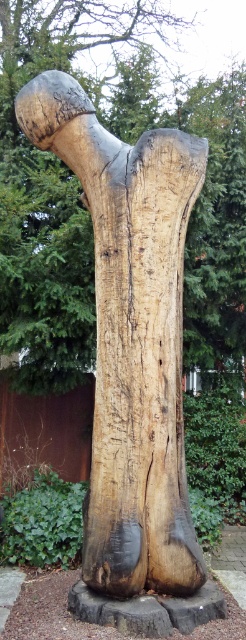
You are an artist planning to photograph the natural wood sculpture at center and the natural wood tree trunk at center. To ensure both are visible in the frame, which object should you position closer to the camera?

The natural wood sculpture at center should be positioned closer to the camera since it is already in front of the natural wood tree trunk at center, ensuring both are visible in the frame.

You are an artist planning to create a miniature version of the scene. You want to ensure the proportions between the natural wood sculpture at center and the natural wood tree trunk at center are accurate. Which object should be made smaller in your model?

The natural wood sculpture at center should be made smaller in the model since it is smaller in size compared to the natural wood tree trunk at center in the original scene.